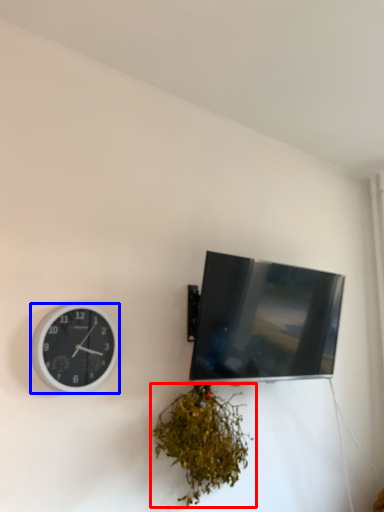
Question: Among these objects, which one is farthest to the camera, houseplant (highlighted by a red box) or wall clock (highlighted by a blue box)?

Choices:
 (A) houseplant
 (B) wall clock

Answer: (A)